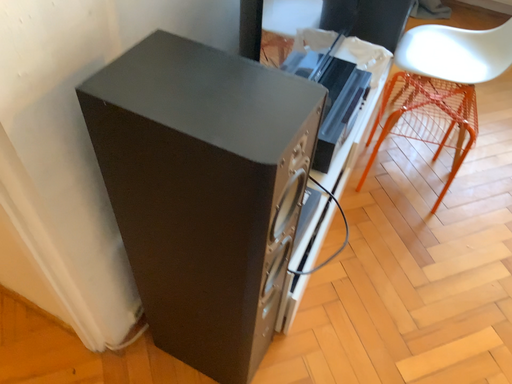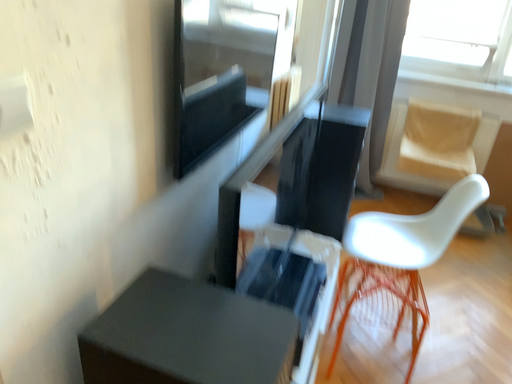
Question: Which way did the camera rotate in the video?

Choices:
 (A) rotated upward
 (B) rotated downward

Answer: (A)